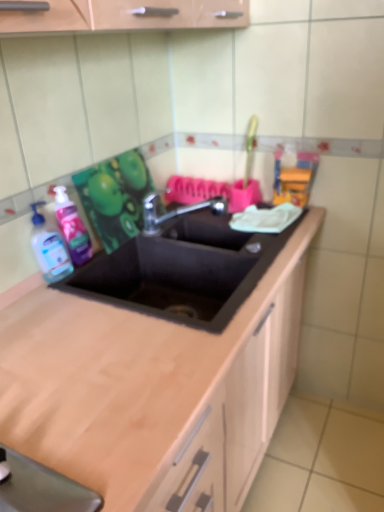
Question: Does black matte sink at center touch metallic faucet at center?

Choices:
 (A) no
 (B) yes

Answer: (A)

Question: Can you confirm if black matte sink at center is smaller than metallic faucet at center?

Choices:
 (A) yes
 (B) no

Answer: (B)

Question: Is black matte sink at center facing towards metallic faucet at center?

Choices:
 (A) no
 (B) yes

Answer: (A)

Question: Is black matte sink at center closer to the viewer compared to metallic faucet at center?

Choices:
 (A) no
 (B) yes

Answer: (B)

Question: Does black matte sink at center have a larger size compared to metallic faucet at center?

Choices:
 (A) yes
 (B) no

Answer: (A)

Question: Does black matte sink at center have a lesser width compared to metallic faucet at center?

Choices:
 (A) no
 (B) yes

Answer: (A)

Question: Is transparent plastic bottle at left wider than metallic faucet at center?

Choices:
 (A) no
 (B) yes

Answer: (A)

Question: Is metallic faucet at center inside transparent plastic bottle at left?

Choices:
 (A) yes
 (B) no

Answer: (B)

Question: Is metallic faucet at center at the back of transparent plastic bottle at left?

Choices:
 (A) no
 (B) yes

Answer: (A)

Question: Is transparent plastic bottle at left bigger than metallic faucet at center?

Choices:
 (A) no
 (B) yes

Answer: (A)

Question: Would you consider transparent plastic bottle at left to be distant from metallic faucet at center?

Choices:
 (A) yes
 (B) no

Answer: (B)

Question: Considering the relative positions of transparent plastic bottle at left and metallic faucet at center in the image provided, is transparent plastic bottle at left to the right of metallic faucet at center from the viewer's perspective?

Choices:
 (A) no
 (B) yes

Answer: (A)

Question: Is translucent plastic soap dispenser at left to the left of black matte sink at center from the viewer's perspective?

Choices:
 (A) yes
 (B) no

Answer: (A)